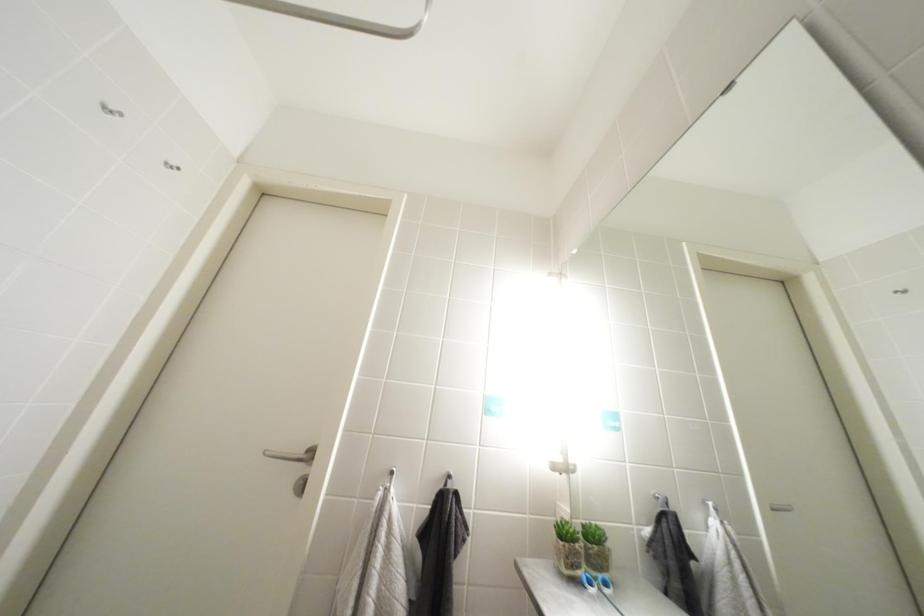
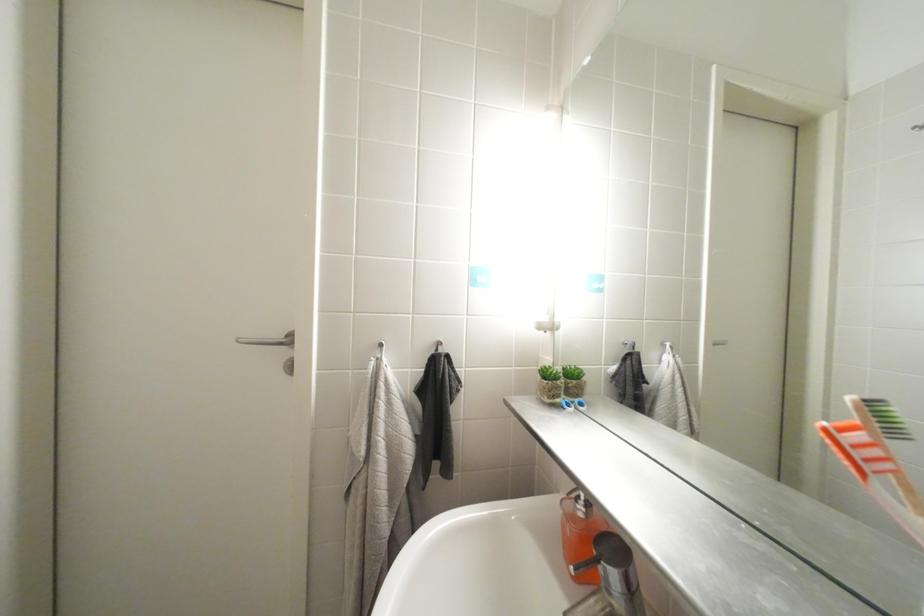
Question: Based on the continuous images, in which direction is the camera rotating? Reply with the corresponding letter.

Choices:
 (A) Left
 (B) Right
 (C) Up
 (D) Down

Answer: (D)